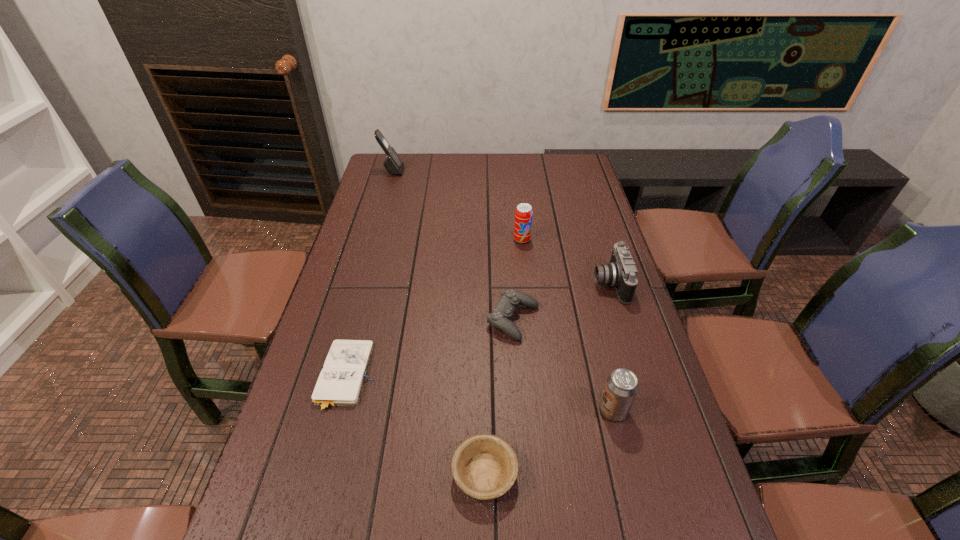
Image resolution: width=960 pixels, height=540 pixels. Identify the location of free space located on the front of the sixth nearest object. (526, 278).

Locate an element on the screen. This screenshot has height=540, width=960. free space located 0.070m on the front of the beer can is located at coordinates (624, 454).

Where is `free location located on the front-facing side of the rightmost object`? This screenshot has width=960, height=540. free location located on the front-facing side of the rightmost object is located at coordinates (573, 284).

Locate an element on the screen. free spot located 0.150m on the front-facing side of the rightmost object is located at coordinates (543, 284).

The width and height of the screenshot is (960, 540). In order to click on free space located on the front-facing side of the rightmost object in this screenshot , I will do `click(577, 284)`.

Identify the location of blank area located 0.320m on the left of the control. (371, 320).

The height and width of the screenshot is (540, 960). Identify the location of free spot located on the back of the bowl. (484, 348).

Image resolution: width=960 pixels, height=540 pixels. Identify the location of vacant space positioned on the right of the notebook. (537, 376).

Locate an element on the screen. This screenshot has height=540, width=960. object at the far edge is located at coordinates (394, 165).

This screenshot has width=960, height=540. What are the coordinates of `cellular telephone that is at the left edge` in the screenshot? It's located at (394, 165).